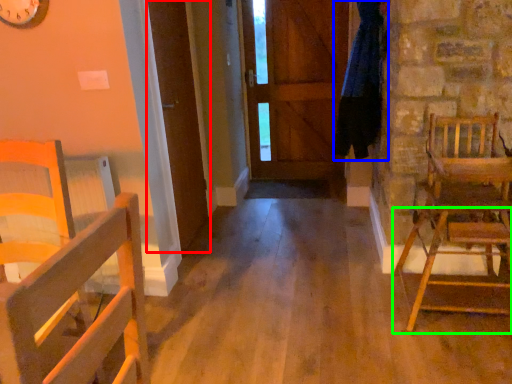
Question: Considering the real-world distances, which object is farthest from door (highlighted by a red box)? clothesline (highlighted by a blue box) or chair (highlighted by a green box)?

Choices:
 (A) clothesline
 (B) chair

Answer: (B)